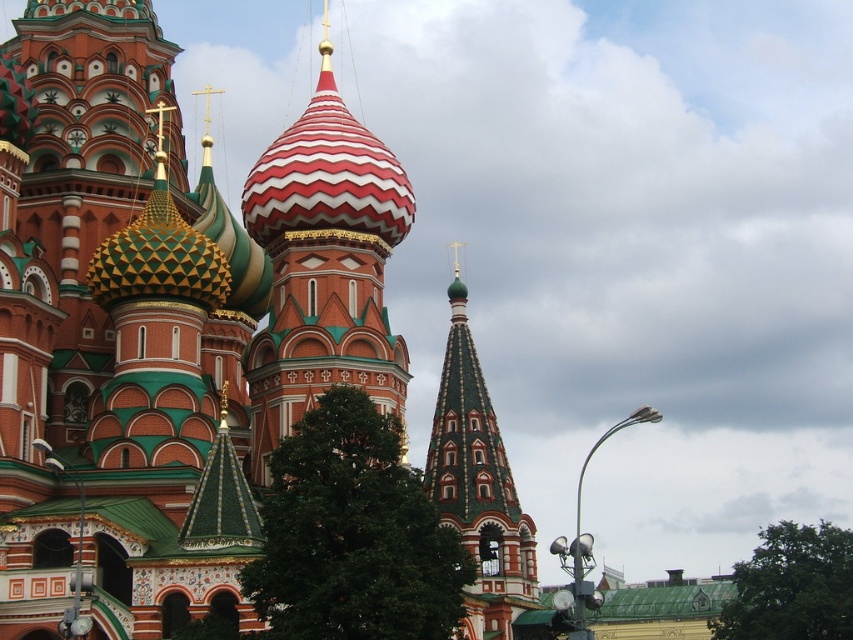
You are a tourist standing in front of St. Basil Cathedral. You see the polychrome mosaic dome at center and the red and white striped dome at center. How far apart are these two domes from each other?

The polychrome mosaic dome at center is 6.90 meters away from the red and white striped dome at center.

You are an architect examining the St. Basil Cathedral. You notice two domes in the image. Which dome is positioned higher in the scene? The options are the polychrome mosaic dome at center and the green mosaic dome at center.

The polychrome mosaic dome at center is positioned higher than the green mosaic dome at center in the scene.

You are a tourist standing in front of St. Basil Cathedral. You notice two domes in the center of the cathedral. The first is the polychrome mosaic dome at center and the second is the red and white striped dome at center. Which of these two domes is taller?

The polychrome mosaic dome at center is taller than the red and white striped dome at center according to the description.